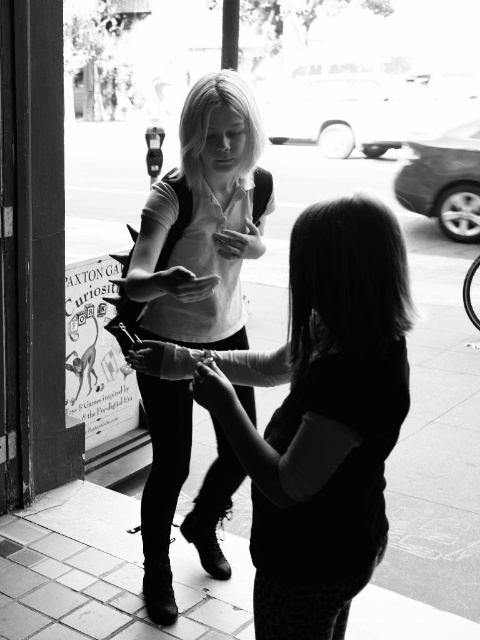
You are a fashion designer observing the two individuals in the scene. You notice the matte black shirt at center and the matte white shirt at center. Which shirt is smaller in size?

The matte black shirt at center is smaller than the matte white shirt at center.